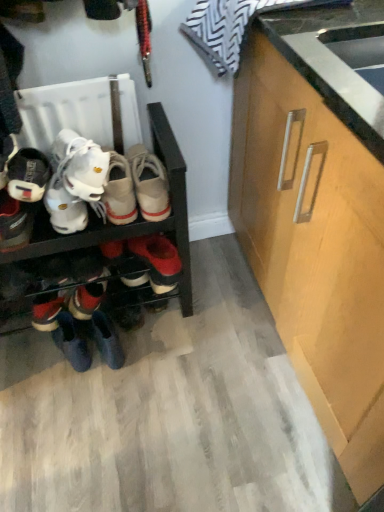
Question: Should I look upward or downward to see leather boot at lower left, the first footwear positioned from the bottom?

Choices:
 (A) up
 (B) down

Answer: (B)

Question: Is matte black sneaker at left, which is the 2th footwear from bottom to top, to the right of light wood cabinet at right from the viewer's perspective?

Choices:
 (A) yes
 (B) no

Answer: (B)

Question: From the image's perspective, is matte black sneaker at left, which is the 2th footwear from bottom to top, beneath light wood cabinet at right?

Choices:
 (A) no
 (B) yes

Answer: (A)

Question: Is matte black sneaker at left, which is the second footwear from top to bottom, beside light wood cabinet at right?

Choices:
 (A) yes
 (B) no

Answer: (B)

Question: Does matte black sneaker at left, which is the second footwear from top to bottom, have a larger size compared to light wood cabinet at right?

Choices:
 (A) yes
 (B) no

Answer: (B)

Question: Does matte black sneaker at left, which is the second footwear from top to bottom, turn towards light wood cabinet at right?

Choices:
 (A) no
 (B) yes

Answer: (A)

Question: Is matte black sneaker at left, which is the second footwear from top to bottom, not near light wood cabinet at right?

Choices:
 (A) no
 (B) yes

Answer: (A)

Question: Can you confirm if light wood cabinet at right is shorter than leather boot at lower left, which appears as the third footwear when viewed from the top?

Choices:
 (A) yes
 (B) no

Answer: (B)

Question: Does light wood cabinet at right have a greater width compared to leather boot at lower left, which appears as the third footwear when viewed from the top?

Choices:
 (A) no
 (B) yes

Answer: (B)

Question: Considering the relative positions of light wood cabinet at right and leather boot at lower left, which appears as the third footwear when viewed from the top, in the image provided, is light wood cabinet at right behind leather boot at lower left, which appears as the third footwear when viewed from the top,?

Choices:
 (A) no
 (B) yes

Answer: (A)

Question: Is light wood cabinet at right positioned far away from leather boot at lower left, the first footwear positioned from the bottom?

Choices:
 (A) yes
 (B) no

Answer: (B)

Question: Can you confirm if light wood cabinet at right is smaller than leather boot at lower left, the first footwear positioned from the bottom?

Choices:
 (A) yes
 (B) no

Answer: (B)

Question: From a real-world perspective, is light wood cabinet at right beneath leather boot at lower left, which appears as the third footwear when viewed from the top?

Choices:
 (A) no
 (B) yes

Answer: (A)

Question: From the image's perspective, is matte black sneaker at left, which is the second footwear from top to bottom, located beneath matte black shoe at left, marked as the 3th footwear in a bottom-to-top arrangement?

Choices:
 (A) yes
 (B) no

Answer: (A)